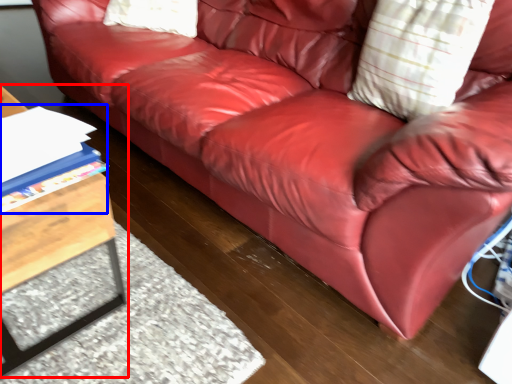
Question: Which point is further to the camera, table (highlighted by a red box) or book (highlighted by a blue box)?

Choices:
 (A) table
 (B) book

Answer: (B)